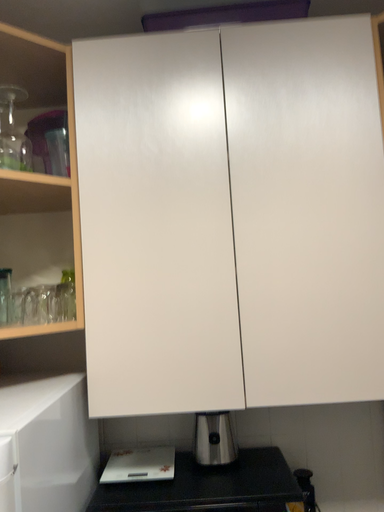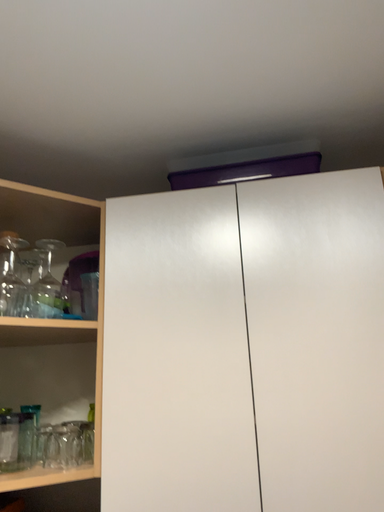
Question: How did the camera likely rotate when shooting the video?

Choices:
 (A) rotated upward
 (B) rotated downward

Answer: (A)